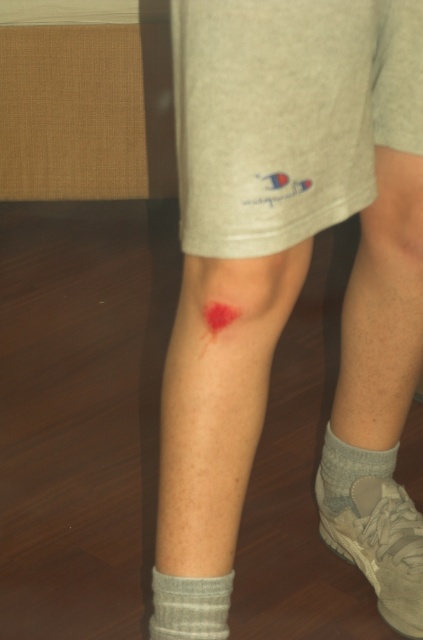
Based on the photo, you are a medical professional assessing a patient. You observe the scarred skin at lower center and the gray cotton sock at lower right. Which object has a greater width?

The scarred skin at lower center has a greater width than the gray cotton sock at lower right.

You are trying to locate two points on the leg shown in the image. The first point is at coordinates point (230, 577) and the second is at point (376, 474). From the perspective of someone looking at the leg, which point is closer to the viewer?

Point (230, 577) is in front of point (376, 474), so it is closer to the viewer.

You are a photographer adjusting your camera to focus on the gray ribbed sock at lower left and the gray cotton sock at lower right. Which sock should you adjust your focus on first if you want to capture both clearly in the same frame?

You should focus on the gray ribbed sock at lower left first because it is closer to the viewer than the gray cotton sock at lower right, so adjusting focus starting from the closer sock ensures both will be in focus when using depth of field properly.